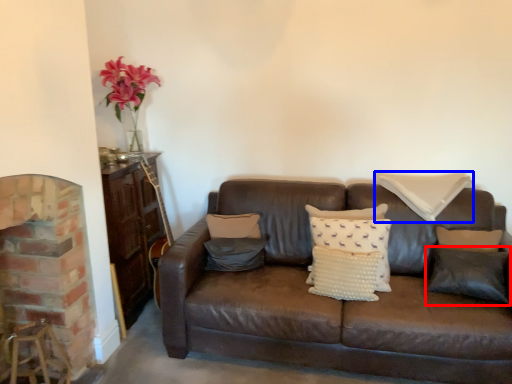
Question: Which object is closer to the camera taking this photo, pillow (highlighted by a red box) or pillow (highlighted by a blue box)?

Choices:
 (A) pillow
 (B) pillow

Answer: (A)